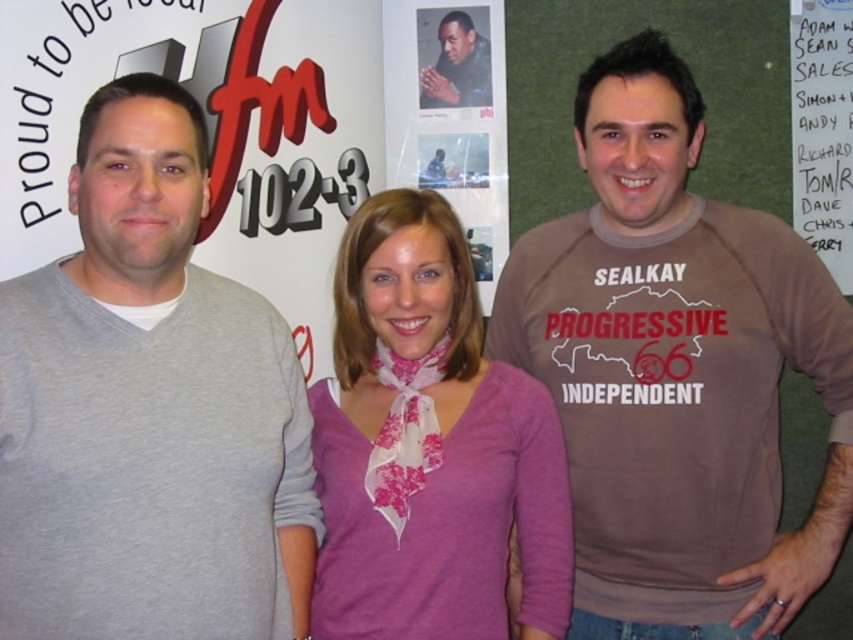
You are standing in the room and want to reach the point marked as point (634, 45). If your arm can extend 1.3 meters, can you reach it without moving your feet?

The point (634, 45) is 1.44 meters away from the viewer, which is beyond the arm extension of 1.3 meters. Therefore, you cannot reach it without moving your feet.